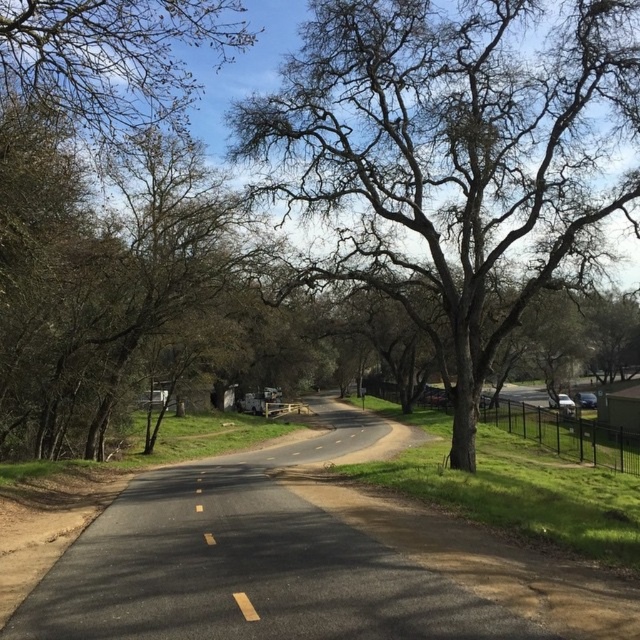
Question: Which point is farther to the camera?

Choices:
 (A) (586, 225)
 (B) (52, 97)

Answer: (A)

Question: Can you confirm if bare branches at center is smaller than bare branches at upper left?

Choices:
 (A) yes
 (B) no

Answer: (B)

Question: Among these objects, which one is nearest to the camera?

Choices:
 (A) bare branches at center
 (B) bare branches at upper left

Answer: (B)

Question: Is bare branches at center positioned before bare branches at upper left?

Choices:
 (A) no
 (B) yes

Answer: (A)

Question: Does bare branches at center have a larger size compared to yellow asphalt line at center?

Choices:
 (A) yes
 (B) no

Answer: (A)

Question: Which object appears closest to the camera in this image?

Choices:
 (A) yellow asphalt line at center
 (B) bare branches at upper left
 (C) bare branches at center

Answer: (A)